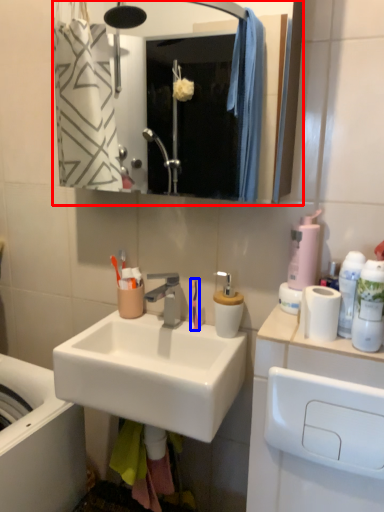
Question: Among these objects, which one is nearest to the camera, mirror (highlighted by a red box) or toothbrush (highlighted by a blue box)?

Choices:
 (A) mirror
 (B) toothbrush

Answer: (A)